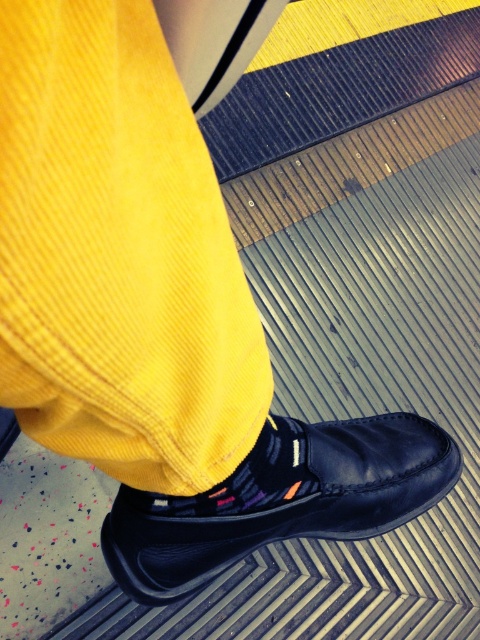
Between point (129, 548) and point (242, 477), which one is positioned behind?

Point (129, 548)

Can you confirm if black leather shoe at lower center is bigger than multicolored knit sock at center?

Indeed, black leather shoe at lower center has a larger size compared to multicolored knit sock at center.

Between point (122, 554) and point (127, 490), which one is positioned behind?

Point (122, 554)

Find the location of a particular element. black leather shoe at lower center is located at coordinates coord(280,499).